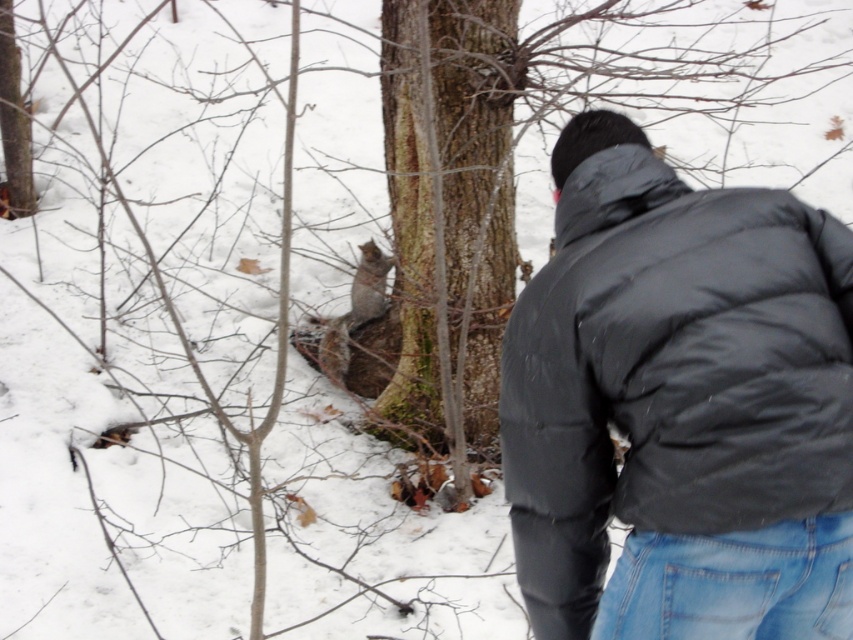
You are standing at the camera position and want to throw a snowball to the black puffy jacket at upper right. The snowball can travel 5 feet. Will it reach?

The distance between the black puffy jacket at upper right and the camera is 6.19 feet, which is farther than the snowball can travel 5 feet. So the snowball won not reach.

You are a photographer trying to capture the gray fur squirrel at center without any obstructions. Given that the black puffy jacket at upper right is blocking your view, can you move to the left to get a clear shot?

The black puffy jacket at upper right is in front of gray fur squirrel at center, so moving to the left might allow you to position yourself behind the jacket and still see the squirrel, but the jacket could still partially block the view depending on its size and distance.

Looking at this image, you are standing at the origin point in the snowy forest scene. You need to move towards the black puffy jacket at upper right. What direction should you head in?

The black puffy jacket at upper right is located at point [637,378], so you should head northeast to reach it.